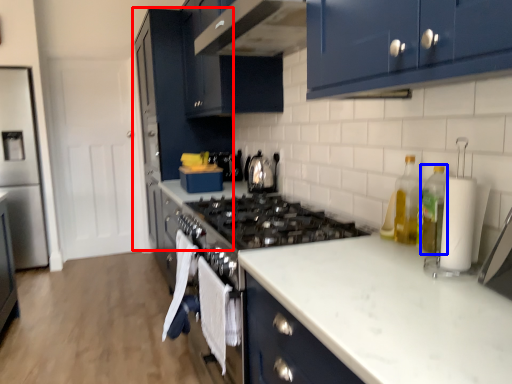
Question: Among these objects, which one is nearest to the camera, cabinetry (highlighted by a red box) or bottle (highlighted by a blue box)?

Choices:
 (A) cabinetry
 (B) bottle

Answer: (B)